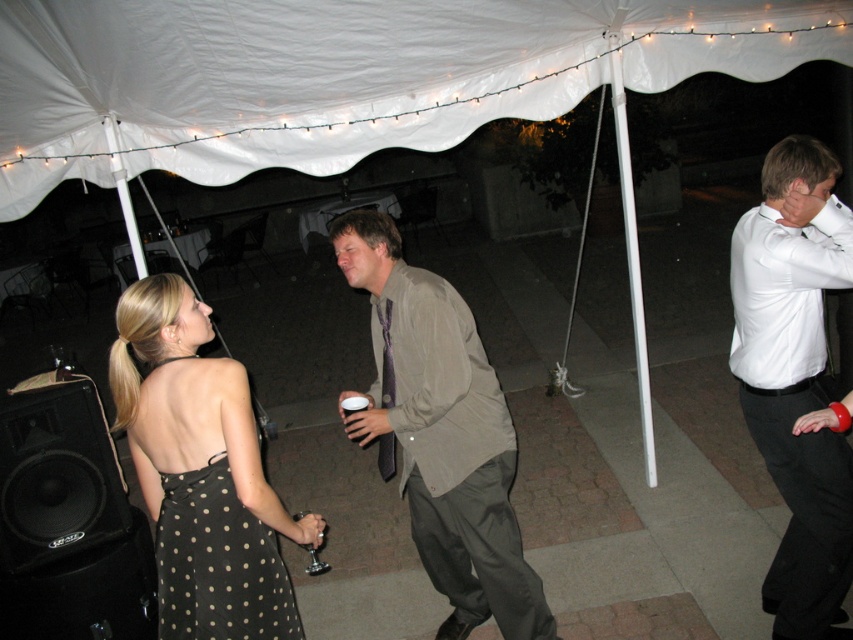
You are a photographer at the event and want to capture a photo that includes both the black satin dress at center and the white glossy shirt at upper right. Based on their positions, which one should you focus on first to ensure both are in frame?

The black satin dress at center is to the left of the white glossy shirt at upper right, so you should focus on the white glossy shirt at upper right first to ensure both are in frame.

What is the color of the dress worn by the person at the coordinates point (201, 472)?

The dress at point (201, 472) is black satin.

You are at a party and want to place a new speaker next to the existing one. The new speaker is the same size as the black plastic speaker at lower left. Where should you place it relative to the white glossy shirt at upper right?

You should place the new speaker to the left of the white glossy shirt at upper right since the black plastic speaker at lower left is positioned to the left of it.